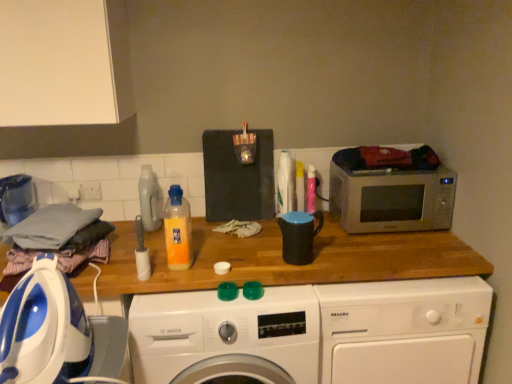
Question: Should I look upward or downward to see white plastic washing machine at center, the third washing machine in the left-to-right sequence?

Choices:
 (A) up
 (B) down

Answer: (B)

Question: Is white plastic washing machine at center, which is counted as the first washing machine, starting from the right, smaller than black matte mug at center, which ranks as the first appliance in back-to-front order?

Choices:
 (A) yes
 (B) no

Answer: (B)

Question: Is white plastic washing machine at center, which is counted as the first washing machine, starting from the right, shorter than black matte mug at center, which appears as the 1th appliance when viewed from the right?

Choices:
 (A) no
 (B) yes

Answer: (A)

Question: Considering the relative sizes of white plastic washing machine at center, the third washing machine in the left-to-right sequence, and black matte mug at center, which appears as the second appliance when viewed from the front, in the image provided, is white plastic washing machine at center, the third washing machine in the left-to-right sequence, thinner than black matte mug at center, which appears as the second appliance when viewed from the front,?

Choices:
 (A) yes
 (B) no

Answer: (B)

Question: Are white plastic washing machine at center, the third washing machine in the left-to-right sequence, and black matte mug at center, which is counted as the 2th appliance, starting from the left, located far from each other?

Choices:
 (A) yes
 (B) no

Answer: (B)

Question: Considering the relative sizes of white plastic washing machine at center, the third washing machine in the left-to-right sequence, and black matte mug at center, which is counted as the 2th appliance, starting from the left, in the image provided, is white plastic washing machine at center, the third washing machine in the left-to-right sequence, wider than black matte mug at center, which is counted as the 2th appliance, starting from the left,?

Choices:
 (A) no
 (B) yes

Answer: (B)

Question: Is white plastic washing machine at center, which is counted as the first washing machine, starting from the right, outside black matte mug at center, which ranks as the first appliance in back-to-front order?

Choices:
 (A) no
 (B) yes

Answer: (B)

Question: Does matte plastic detergent at center, the 2th bottle viewed from the front, turn towards silver metallic microwave at right?

Choices:
 (A) no
 (B) yes

Answer: (A)

Question: Is silver metallic microwave at right at the back of matte plastic detergent at center, the 2th bottle viewed from the front?

Choices:
 (A) yes
 (B) no

Answer: (B)

Question: Is matte plastic detergent at center, which ranks as the first bottle in back-to-front order, at the left side of silver metallic microwave at right?

Choices:
 (A) no
 (B) yes

Answer: (B)

Question: Can you confirm if matte plastic detergent at center, the 2th bottle viewed from the front, is smaller than silver metallic microwave at right?

Choices:
 (A) yes
 (B) no

Answer: (A)

Question: Is silver metallic microwave at right a part of matte plastic detergent at center, which ranks as the first bottle in back-to-front order?

Choices:
 (A) no
 (B) yes

Answer: (A)

Question: From a real-world perspective, does matte plastic detergent at center, placed as the second bottle when sorted from right to left, sit lower than silver metallic microwave at right?

Choices:
 (A) no
 (B) yes

Answer: (A)

Question: From a real-world perspective, is white plastic roll at center, which is the 1th appliance in front-to-back order, on matte plastic detergent at center, placed as the second bottle when sorted from right to left?

Choices:
 (A) yes
 (B) no

Answer: (B)